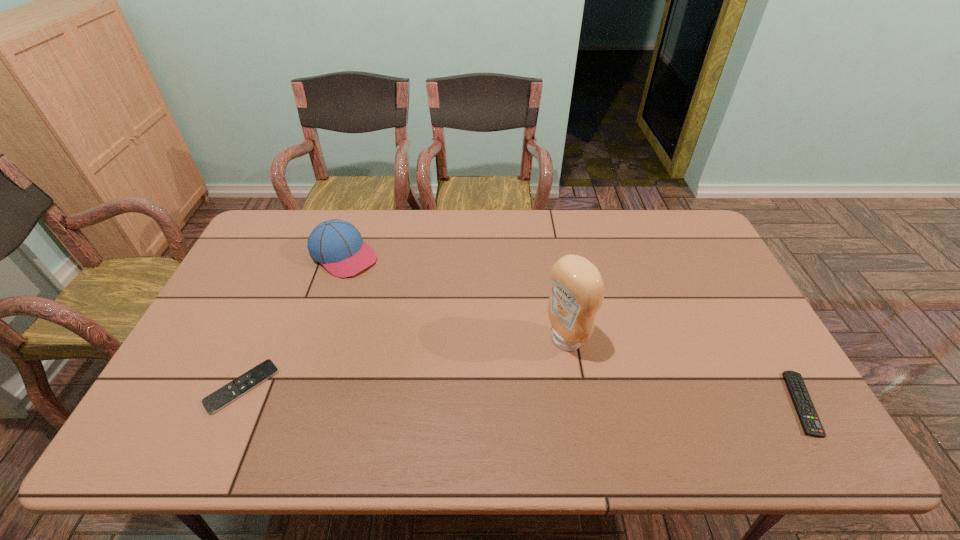
At what (x,y) coordinates should I click in order to perform the action: click on free space located 0.140m on the front-facing side of the baseball cap. Please return your answer as a coordinate pair (x, y). This screenshot has height=540, width=960. Looking at the image, I should click on (393, 292).

The image size is (960, 540). In order to click on free space located on the front-facing side of the baseball cap in this screenshot , I will do `click(410, 305)`.

You are a GUI agent. You are given a task and a screenshot of the screen. Output one action in this format:
    pyautogui.click(x=<x>, y=<y>)
    Task: Click on the free space located on the front-facing side of the baseball cap
    This screenshot has height=540, width=960.
    Given the screenshot: What is the action you would take?
    pyautogui.click(x=408, y=303)

Find the location of `vacant space situated 0.270m on the label of the condiment`. vacant space situated 0.270m on the label of the condiment is located at coordinates (464, 397).

This screenshot has height=540, width=960. What are the coordinates of `vacant space located 0.330m on the label of the condiment` in the screenshot? It's located at (442, 409).

Find the location of `blank area located on the label of the condiment`. blank area located on the label of the condiment is located at coordinates (449, 405).

Where is `object at the far edge`? object at the far edge is located at coordinates (336, 244).

The image size is (960, 540). I want to click on object present at the left edge, so coord(222,397).

Where is `object positioned at the right edge`? object positioned at the right edge is located at coordinates (807, 414).

Identify the location of object situated at the near left corner. Image resolution: width=960 pixels, height=540 pixels. (222, 397).